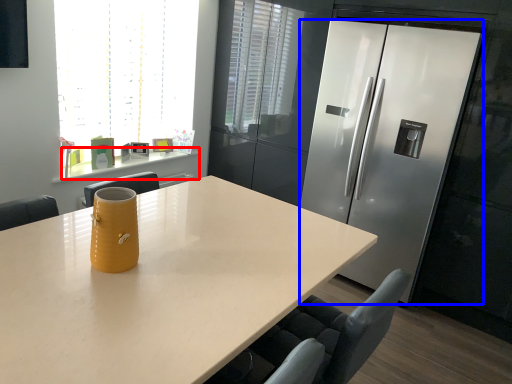
Question: Which object is closer to the camera taking this photo, counter (highlighted by a red box) or refrigerator (highlighted by a blue box)?

Choices:
 (A) counter
 (B) refrigerator

Answer: (B)